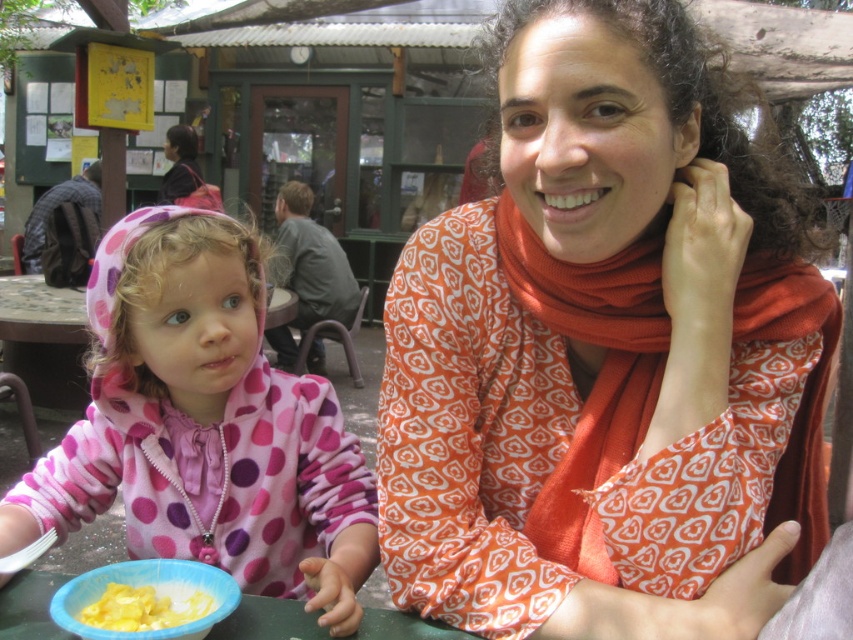
Question: Does pink fleece jacket at left come behind yellow creamy pasta at lower left?

Choices:
 (A) no
 (B) yes

Answer: (B)

Question: Does pink fleece jacket at left have a lesser width compared to blue plastic bowl at lower center?

Choices:
 (A) no
 (B) yes

Answer: (B)

Question: Which point is farther to the camera?

Choices:
 (A) (204, 611)
 (B) (607, 240)

Answer: (A)

Question: Is printed orange scarf at center above pink fleece jacket at left?

Choices:
 (A) yes
 (B) no

Answer: (A)

Question: Which point appears closest to the camera in this image?

Choices:
 (A) (47, 596)
 (B) (142, 612)

Answer: (B)

Question: Estimate the real-world distances between objects in this image. Which object is closer to the blue plastic bowl at lower center?

Choices:
 (A) printed orange scarf at center
 (B) pink fleece jacket at left
 (C) blue plastic bowl at lower left

Answer: (C)